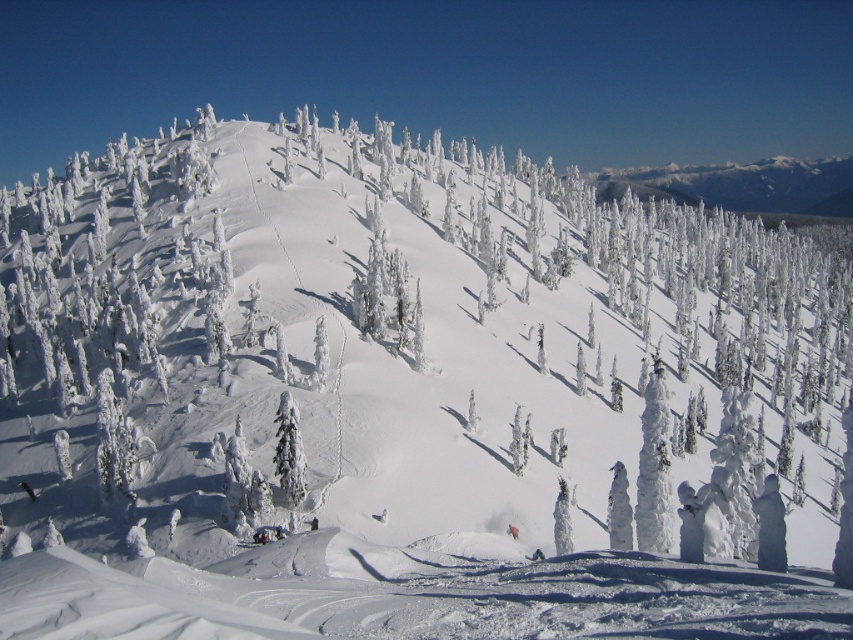
Between point (653, 376) and point (556, 544), which one is positioned in front?

Point (556, 544) is in front.

Does white frosty tree at center-right have a greater width compared to white frosty tree at center?

Correct, the width of white frosty tree at center-right exceeds that of white frosty tree at center.

Is point (646, 388) positioned in front of point (556, 515)?

No, it is not.

At what (x,y) coordinates should I click in order to perform the action: click on white frosty tree at center-right. Please return your answer as a coordinate pair (x, y). The image size is (853, 640). Looking at the image, I should click on (654, 467).